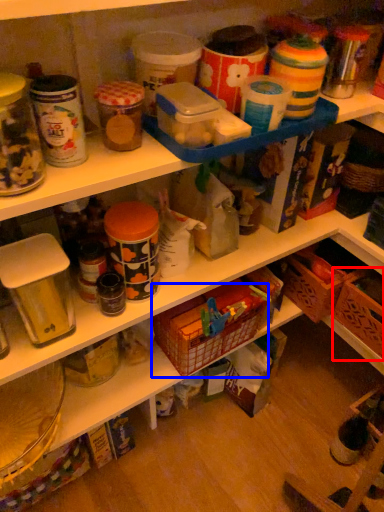
Question: Among these objects, which one is nearest to the camera, basket (highlighted by a red box) or basket (highlighted by a blue box)?

Choices:
 (A) basket
 (B) basket

Answer: (B)